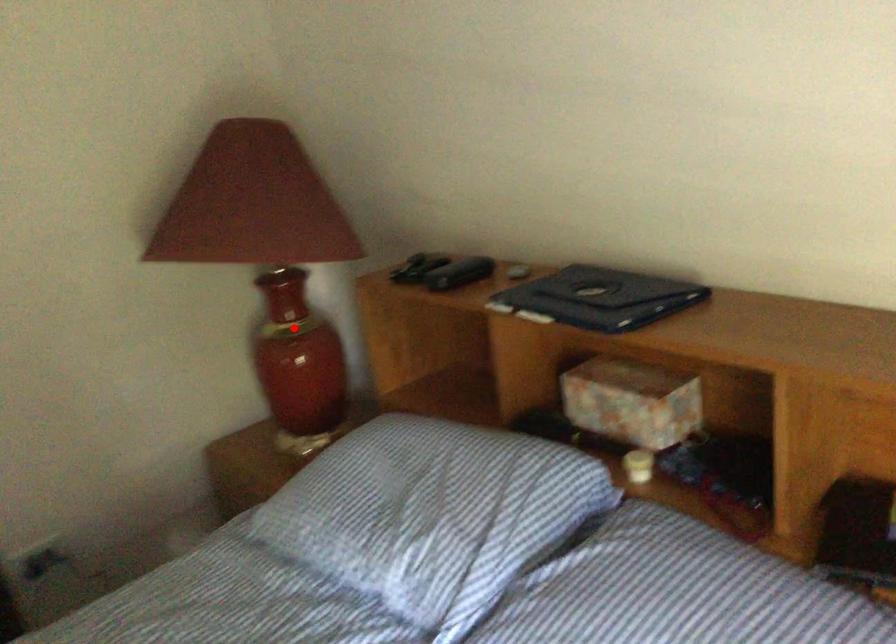
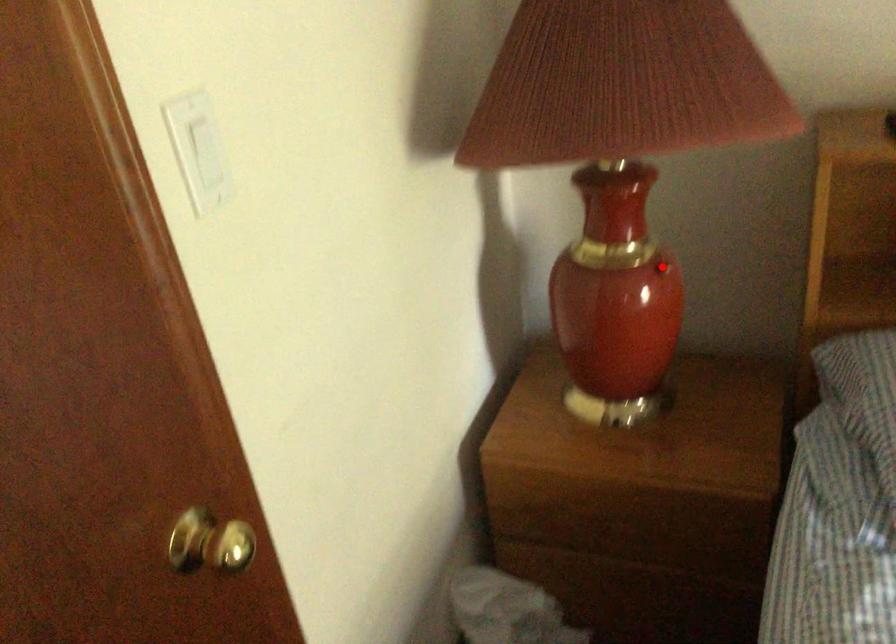
From the picture: I am providing you with two images of the same scene from different viewpoints. A red point is marked on the first image and another point is marked on the second image. Is the red point in image1 aligned with the point shown in image2?

Yes